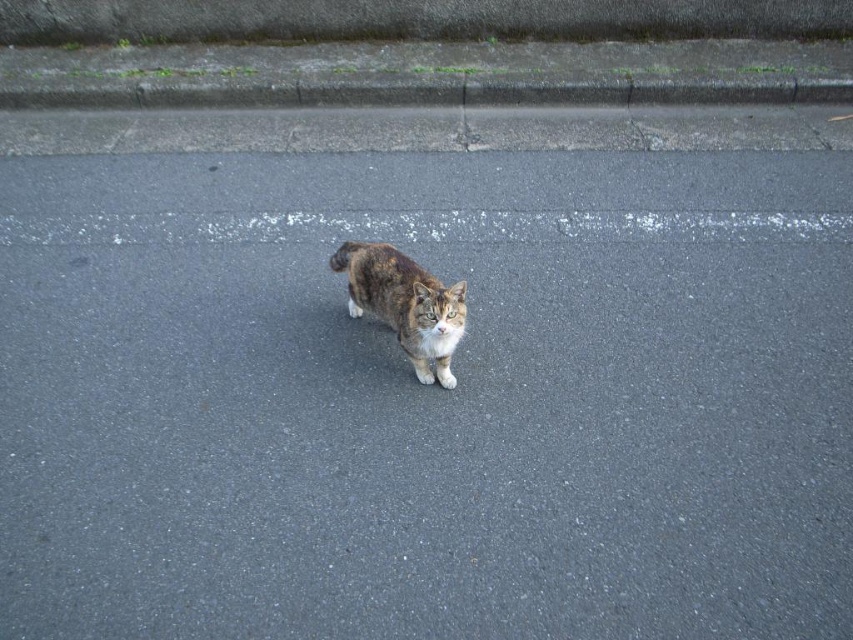
Is gray concrete curb at upper center wider than tabby fur cat at center?

Indeed, gray concrete curb at upper center has a greater width compared to tabby fur cat at center.

Which is more to the left, gray concrete curb at upper center or tabby fur cat at center?

tabby fur cat at center

Between point (585, 92) and point (396, 333), which one is positioned behind?

Positioned behind is point (585, 92).

At what (x,y) coordinates should I click in order to perform the action: click on gray concrete curb at upper center. Please return your answer as a coordinate pair (x, y). The height and width of the screenshot is (640, 853). Looking at the image, I should click on (428, 93).